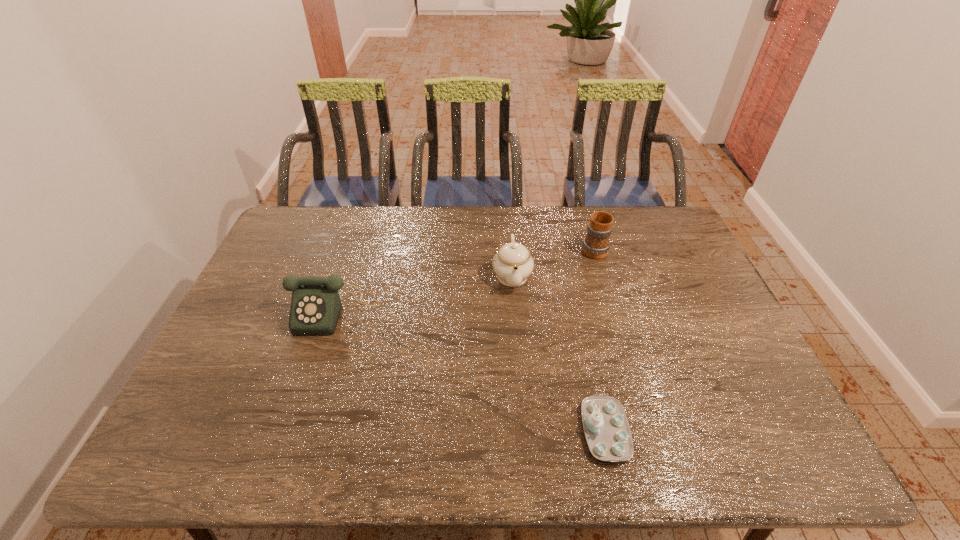
In order to click on free spot between the mug and the farther chinaware in this screenshot , I will do `click(553, 262)`.

Find the location of a particular element. This screenshot has width=960, height=540. vacant space in between the shorter chinaware and the mug is located at coordinates (599, 339).

Locate an element on the screen. This screenshot has width=960, height=540. vacant space that's between the farther chinaware and the leftmost object is located at coordinates (x=423, y=294).

Where is `vacant region between the taller chinaware and the mug`? This screenshot has height=540, width=960. vacant region between the taller chinaware and the mug is located at coordinates (553, 262).

Find the location of a particular element. Image resolution: width=960 pixels, height=540 pixels. free space between the leftmost object and the shortest object is located at coordinates pyautogui.click(x=469, y=372).

At what (x,y) coordinates should I click in order to perform the action: click on free space that is in between the shortest object and the left chinaware. Please return your answer as a coordinate pair (x, y). This screenshot has height=540, width=960. Looking at the image, I should click on (559, 353).

You are a GUI agent. You are given a task and a screenshot of the screen. Output one action in this format:
    pyautogui.click(x=<x>, y=<y>)
    Task: Click on the vacant area that lies between the telephone and the mug
    The height and width of the screenshot is (540, 960).
    Given the screenshot: What is the action you would take?
    [465, 280]

Locate an element on the screen. The height and width of the screenshot is (540, 960). vacant point located between the leftmost object and the nearer chinaware is located at coordinates (469, 372).

Where is `vacant area that lies between the telephone and the left chinaware`? vacant area that lies between the telephone and the left chinaware is located at coordinates tap(423, 294).

Locate an element on the screen. free spot between the shortest object and the farther chinaware is located at coordinates pyautogui.click(x=559, y=353).